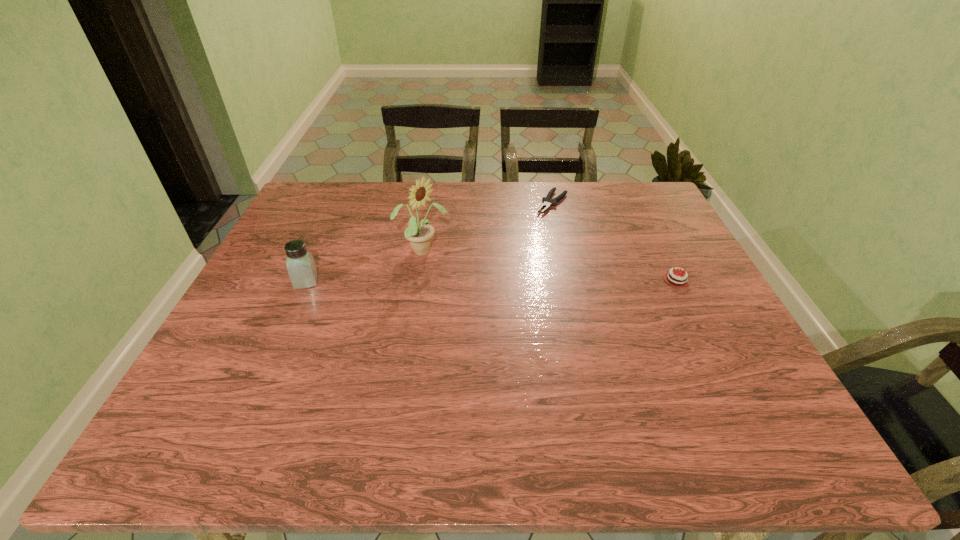
Identify the location of vacant space on the desktop that is between the second tallest object and the third tallest object and is positioned on the front-facing side of the tallest object. (479, 281).

The height and width of the screenshot is (540, 960). I want to click on free space on the desktop that is between the leftmost object and the rightmost object and is positioned at the gripping part of the farthest object, so click(x=481, y=281).